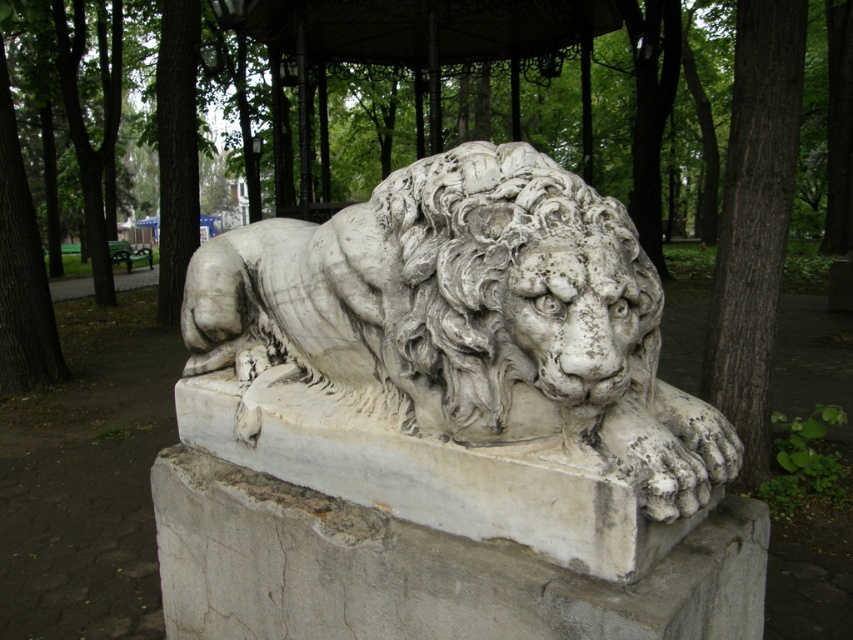
You are a park visitor standing in front of the white marble lion at center. You want to take a photo of the dark brown bark tree at right without the lion in the frame. Is it possible to position yourself so that the tree is visible but the lion is not?

The white marble lion at center is in front of the dark brown bark tree at right, so you cannot take a photo of the tree without the lion blocking it. Move to the side or behind the sculpture to capture the tree alone.